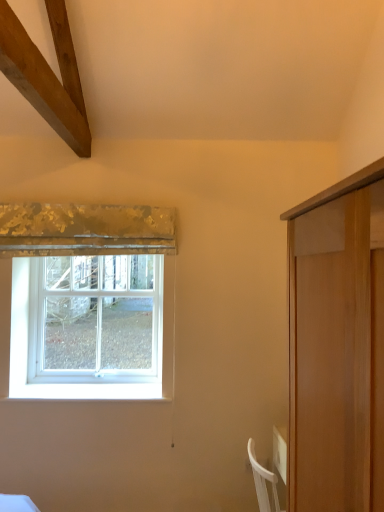
Image resolution: width=384 pixels, height=512 pixels. I want to click on vacant space situated above gold textured fabric at upper left (from a real-world perspective), so click(x=102, y=199).